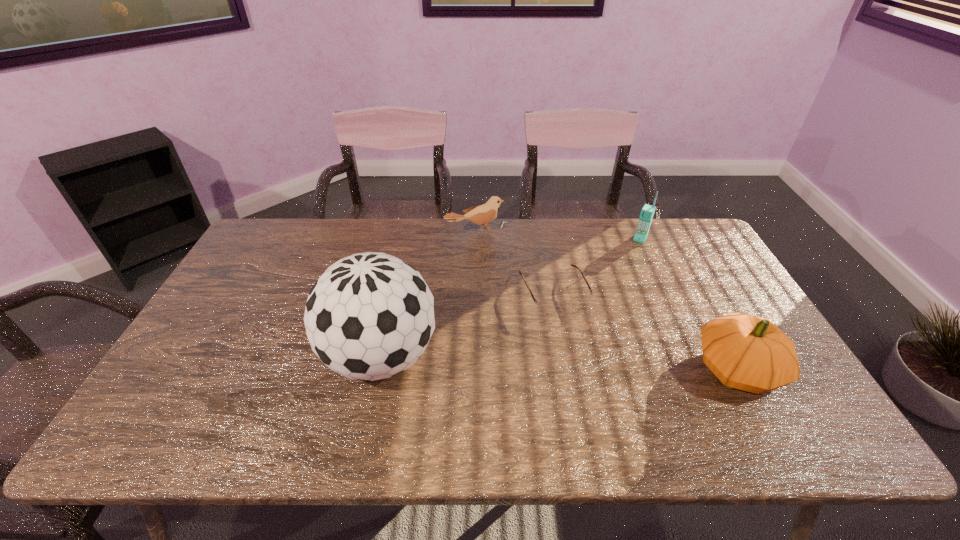
Find the location of a particular element. The width and height of the screenshot is (960, 540). free location located 0.170m at the beak of the fourth tallest object is located at coordinates (513, 269).

Identify the location of vacant region located at the beak of the fourth tallest object. Image resolution: width=960 pixels, height=540 pixels. (531, 293).

The height and width of the screenshot is (540, 960). Identify the location of free spot located 0.110m at the beak of the fourth tallest object. coord(504,259).

This screenshot has height=540, width=960. Identify the location of vacant space located on the front-facing side of the shortest object. (610, 404).

Find the location of a particular element. blank area located on the front-facing side of the shortest object is located at coordinates (606, 397).

Where is `vacant position located 0.250m on the front-facing side of the shortest object`? The height and width of the screenshot is (540, 960). vacant position located 0.250m on the front-facing side of the shortest object is located at coordinates click(x=602, y=390).

Where is `cellular telephone at the far edge`? This screenshot has height=540, width=960. cellular telephone at the far edge is located at coordinates (647, 212).

This screenshot has width=960, height=540. What are the coordinates of `bird located at the far edge` in the screenshot? It's located at (481, 215).

Find the location of a particular element. This screenshot has width=960, height=540. soccer ball that is at the near edge is located at coordinates (370, 316).

At what (x,y) coordinates should I click in order to perform the action: click on gourd that is at the near edge. Please return your answer as a coordinate pair (x, y). The width and height of the screenshot is (960, 540). Looking at the image, I should click on (749, 353).